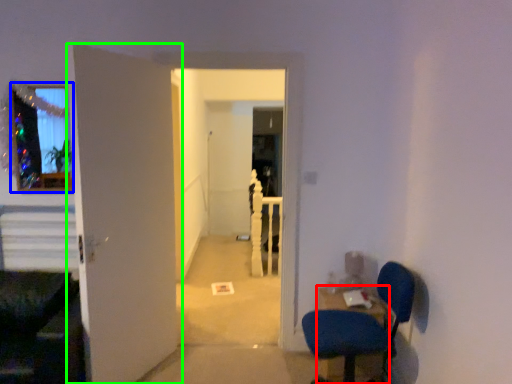
Question: Considering the real-world distances, which object is farthest from table (highlighted by a red box)? glass window (highlighted by a blue box) or door (highlighted by a green box)?

Choices:
 (A) glass window
 (B) door

Answer: (A)